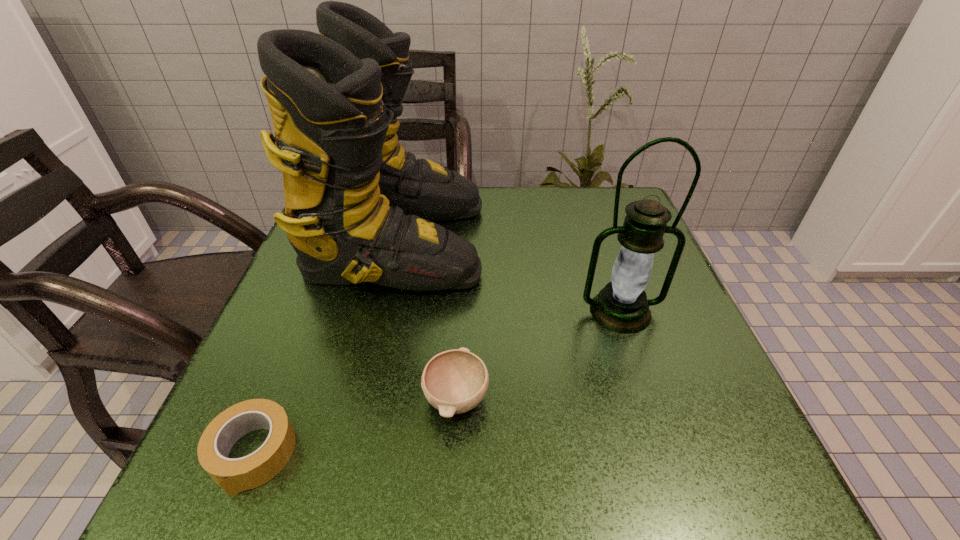
Find the location of a particular element. This screenshot has width=960, height=540. object that is the closest to the duct tape is located at coordinates (455, 381).

Identify which object is the third closest to the duct tape. Please provide its 2D coordinates. Your answer should be formatted as a tuple, i.e. [(x, y)], where the tuple contains the x and y coordinates of a point satisfying the conditions above.

[(622, 306)]

Identify the location of free space that satisfies the following two spatial constraints: 1. on the front side of the bowl; 2. on the right side of the tallest object. The height and width of the screenshot is (540, 960). (363, 399).

Locate an element on the screen. This screenshot has height=540, width=960. free location that satisfies the following two spatial constraints: 1. on the front side of the third tallest object; 2. on the right side of the ski boots is located at coordinates (363, 399).